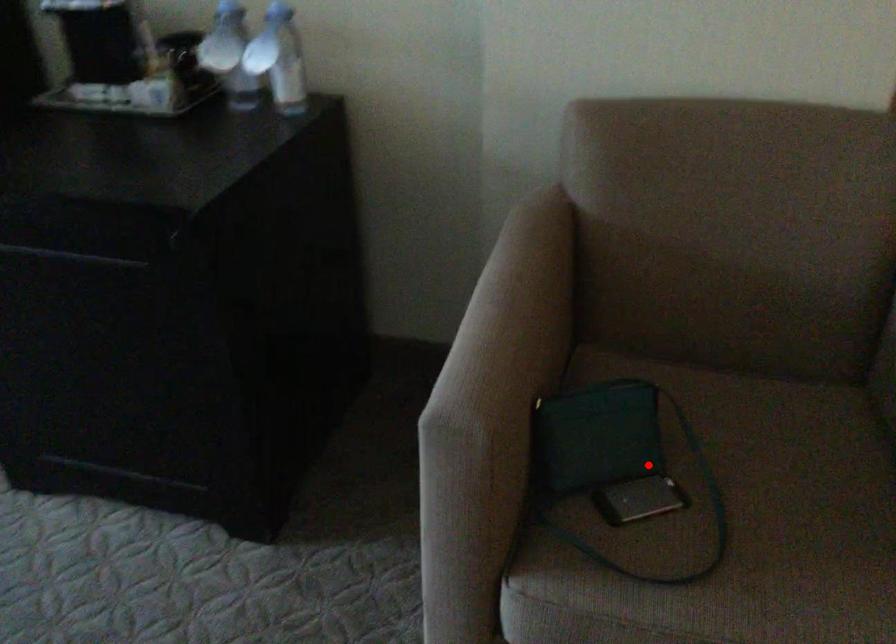
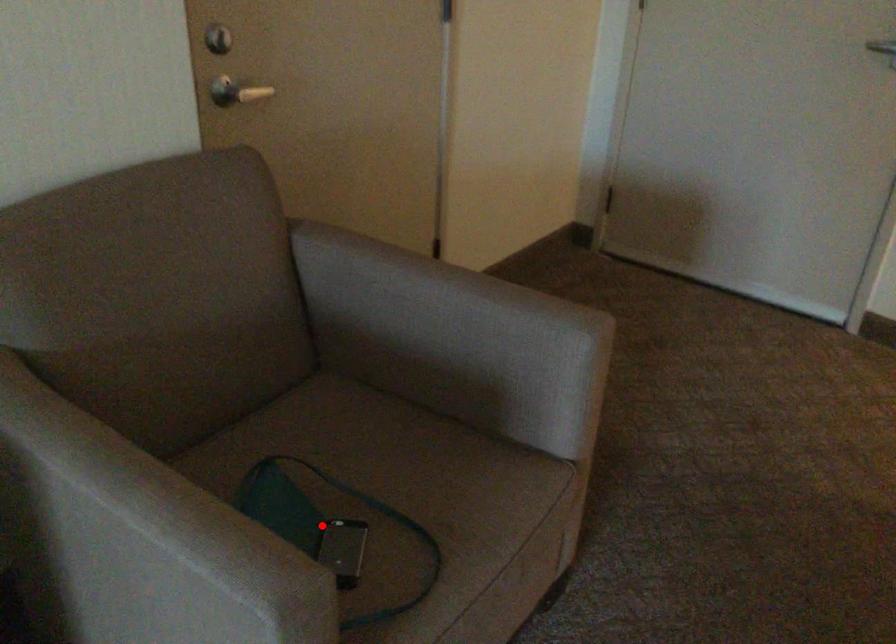
I am providing you with two images of the same scene from different viewpoints. A red point is marked on the first image and another point is marked on the second image. Does the point marked in image1 correspond to the same location as the one in image2?

Yes